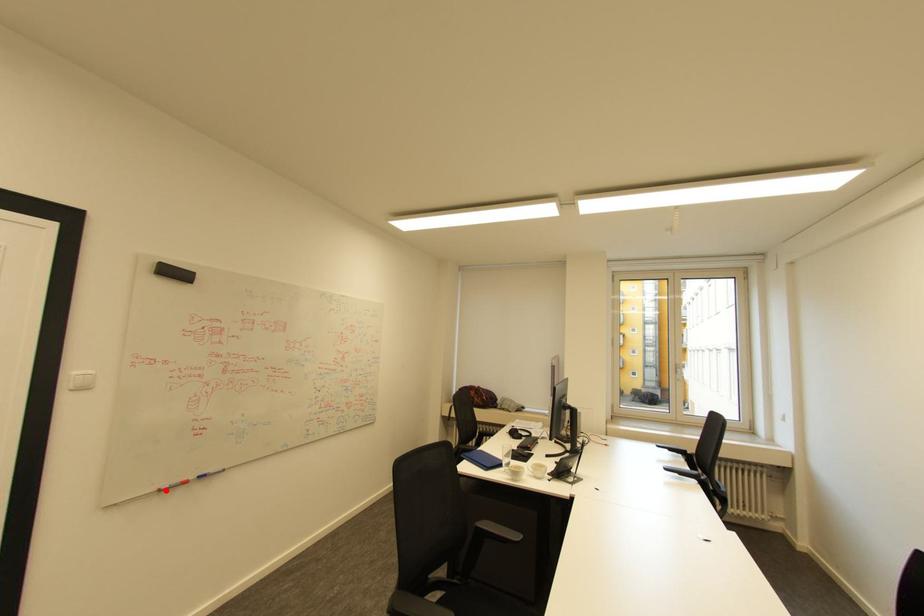
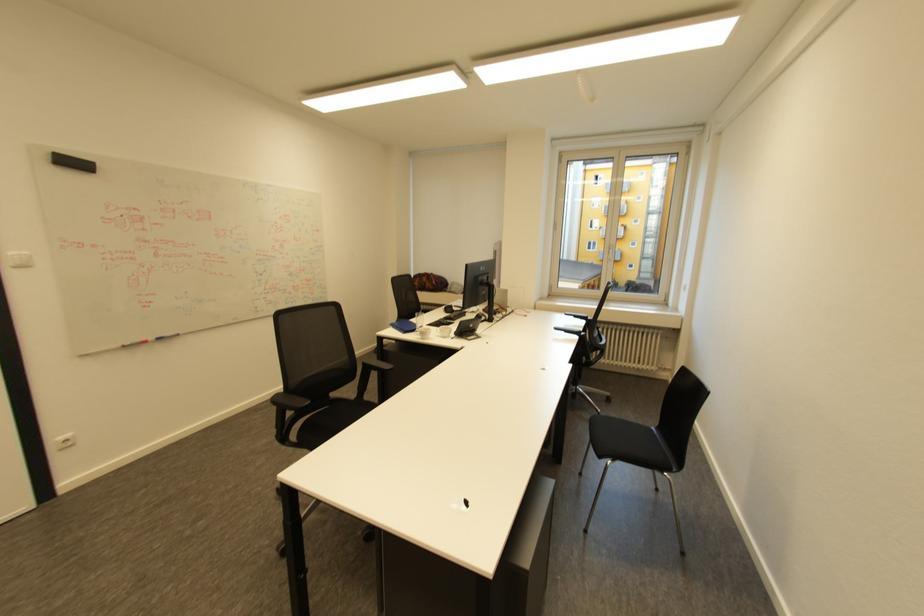
Locate, in the second image, the point that corresponds to the highlighted location in the first image.

(128, 346)